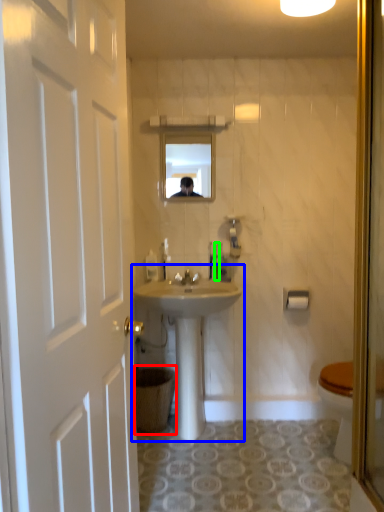
Question: Which is farther away from trash bin/can (highlighted by a red box)? sink (highlighted by a blue box) or toiletries (highlighted by a green box)?

Choices:
 (A) sink
 (B) toiletries

Answer: (B)